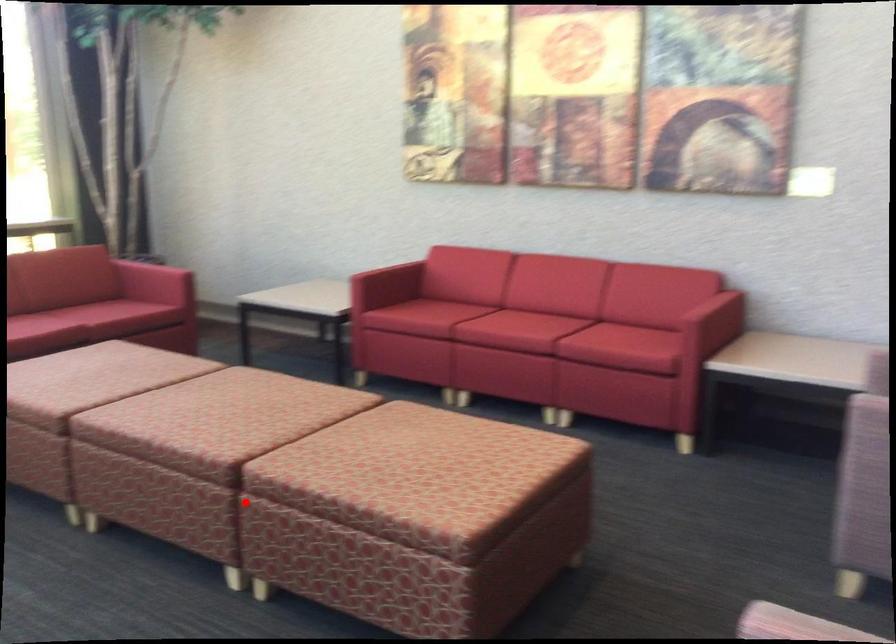
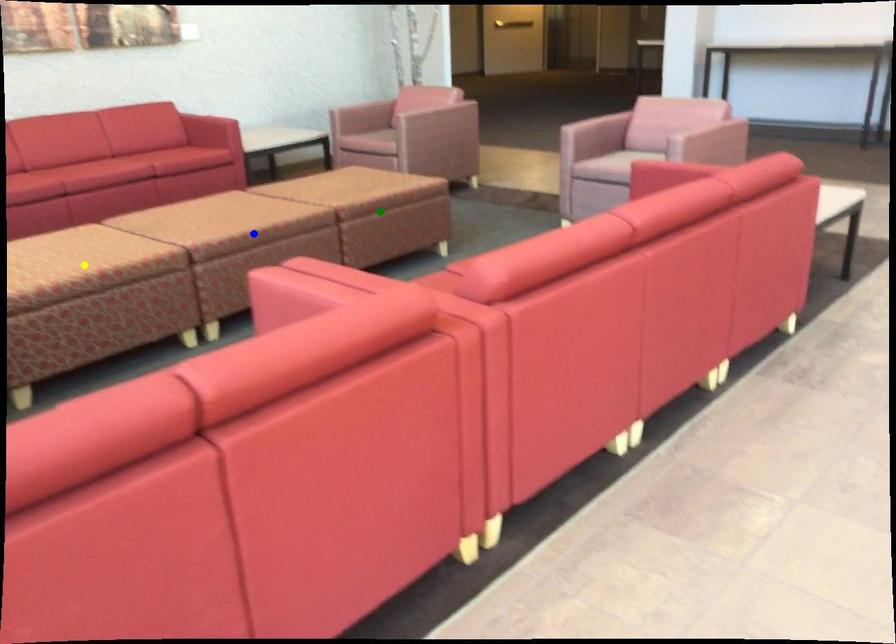
Question: I am providing you with two images of the same scene from different viewpoints. A red point is marked on the first image. You are given multiple points on the second image. Which mark in image 2 goes with the point in image 1?

Choices:
 (A) green point
 (B) yellow point
 (C) blue point

Answer: (A)